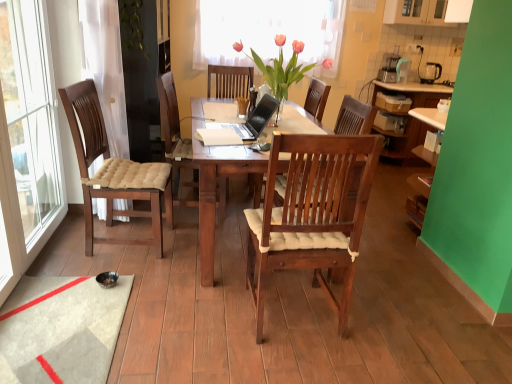
Question: Does green leafy plant at upper left have a greater width compared to pink matte vase at center?

Choices:
 (A) yes
 (B) no

Answer: (B)

Question: From a real-world perspective, does green leafy plant at upper left stand above pink matte vase at center?

Choices:
 (A) no
 (B) yes

Answer: (B)

Question: Does green leafy plant at upper left have a lesser height compared to pink matte vase at center?

Choices:
 (A) yes
 (B) no

Answer: (A)

Question: Would you consider green leafy plant at upper left to be distant from pink matte vase at center?

Choices:
 (A) no
 (B) yes

Answer: (A)

Question: From the image's perspective, is green leafy plant at upper left over pink matte vase at center?

Choices:
 (A) no
 (B) yes

Answer: (B)

Question: Is pink matte vase at center at the back of green leafy plant at upper left?

Choices:
 (A) yes
 (B) no

Answer: (B)

Question: From the image's perspective, is black plastic kettle at upper right located beneath satin black laptop at center?

Choices:
 (A) yes
 (B) no

Answer: (B)

Question: Does black plastic kettle at upper right have a smaller size compared to satin black laptop at center?

Choices:
 (A) yes
 (B) no

Answer: (A)

Question: From a real-world perspective, is black plastic kettle at upper right physically above satin black laptop at center?

Choices:
 (A) no
 (B) yes

Answer: (B)

Question: Is black plastic kettle at upper right in front of satin black laptop at center?

Choices:
 (A) yes
 (B) no

Answer: (B)

Question: Does black plastic kettle at upper right have a lesser width compared to satin black laptop at center?

Choices:
 (A) yes
 (B) no

Answer: (A)

Question: Is black plastic kettle at upper right shorter than satin black laptop at center?

Choices:
 (A) yes
 (B) no

Answer: (B)

Question: Does white plastic power outlet at upper right have a lesser height compared to black plastic kettle at upper right?

Choices:
 (A) no
 (B) yes

Answer: (B)